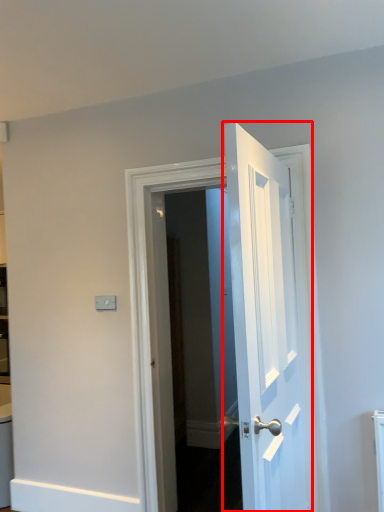
Question: Observing the image, what is the correct spatial positioning of door (annotated by the red box) in reference to door?

Choices:
 (A) right
 (B) left

Answer: (A)